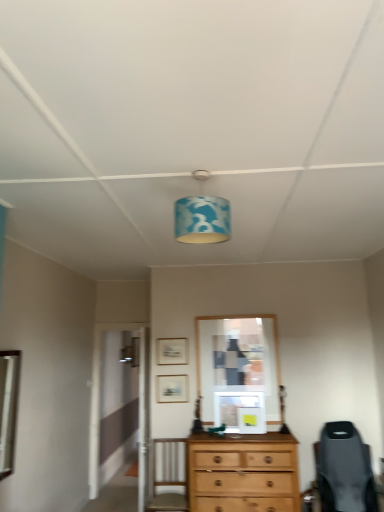
Identify the location of blue fabric lampshade at center. The width and height of the screenshot is (384, 512). (202, 219).

This screenshot has width=384, height=512. Identify the location of matte wooden picture frame at center, which appears as the 2th picture frame when viewed from the back. (172, 389).

From the image's perspective, is blue fabric lampshade at center located beneath matte wooden picture frame at center, the first picture frame positioned from the front?

Actually, blue fabric lampshade at center appears above matte wooden picture frame at center, the first picture frame positioned from the front, in the image.

From a real-world perspective, count 2nd picture frames downward from the blue fabric lampshade at center and point to it. Please provide its 2D coordinates.

[(172, 389)]

From the picture: From a real-world perspective, does blue fabric lampshade at center sit lower than matte wooden picture frame at center, which is counted as the 2th picture frame, starting from the top?

No.

Who is more distant, blue fabric lampshade at center or matte wooden picture frame at center, which is counted as the 2th picture frame, starting from the top?

matte wooden picture frame at center, which is counted as the 2th picture frame, starting from the top.

Are blue fabric lampshade at center and matte gold picture frame at center, the first picture frame from the top, located far from each other?

Absolutely, blue fabric lampshade at center is distant from matte gold picture frame at center, the first picture frame from the top.

How different are the orientations of blue fabric lampshade at center and matte gold picture frame at center, the 2th picture frame when ordered from front to back, in degrees?

179 degrees separate the facing orientations of blue fabric lampshade at center and matte gold picture frame at center, the 2th picture frame when ordered from front to back.

Choose the correct answer: Is blue fabric lampshade at center inside matte gold picture frame at center, the first picture frame from the top, or outside it?

blue fabric lampshade at center exists outside the volume of matte gold picture frame at center, the first picture frame from the top.

In the image, is blue fabric lampshade at center positioned in front of or behind matte gold picture frame at center, the first picture frame from the top?

blue fabric lampshade at center is positioned closer to the viewer than matte gold picture frame at center, the first picture frame from the top.

Which of these two, matte gold picture frame at center, which is the first picture frame in back-to-front order, or blue fabric lampshade at center, stands taller?

Standing taller between the two is blue fabric lampshade at center.

Considering the relative positions of matte gold picture frame at center, which is the first picture frame in back-to-front order, and blue fabric lampshade at center in the image provided, is matte gold picture frame at center, which is the first picture frame in back-to-front order, behind blue fabric lampshade at center?

Yes, matte gold picture frame at center, which is the first picture frame in back-to-front order, is further from the camera.

From a real-world perspective, which object rests below the other?

matte gold picture frame at center, the 2th picture frame when ordered from front to back.

Can we say matte gold picture frame at center, the 2th picture frame when ordered from front to back, lies outside blue fabric lampshade at center?

matte gold picture frame at center, the 2th picture frame when ordered from front to back, lies outside blue fabric lampshade at center's area.

Is blue fabric lampshade at center turned away from silver metallic mirror at left?

No, blue fabric lampshade at center is not facing away from silver metallic mirror at left.

Does blue fabric lampshade at center touch silver metallic mirror at left?

No, blue fabric lampshade at center is not touching silver metallic mirror at left.

Considering the sizes of blue fabric lampshade at center and silver metallic mirror at left in the image, is blue fabric lampshade at center taller or shorter than silver metallic mirror at left?

blue fabric lampshade at center is shorter than silver metallic mirror at left.

Is matte wooden picture frame at center, which appears as the 2th picture frame when viewed from the back, wider than blue fabric lampshade at center?

No, matte wooden picture frame at center, which appears as the 2th picture frame when viewed from the back, is not wider than blue fabric lampshade at center.

From a real-world perspective, is matte wooden picture frame at center, which appears as the 2th picture frame when viewed from the back, beneath blue fabric lampshade at center?

Yes, from a real-world perspective, matte wooden picture frame at center, which appears as the 2th picture frame when viewed from the back, is below blue fabric lampshade at center.

From the image's perspective, is matte wooden picture frame at center, which is counted as the 2th picture frame, starting from the top, positioned above or below blue fabric lampshade at center?

matte wooden picture frame at center, which is counted as the 2th picture frame, starting from the top, is situated lower than blue fabric lampshade at center in the image.

Is matte gold picture frame at center, the 2th picture frame when ordered from front to back, in contact with silver metallic mirror at left?

No, matte gold picture frame at center, the 2th picture frame when ordered from front to back, is not beside silver metallic mirror at left.

Does matte gold picture frame at center, the 2th picture frame when ordered from front to back, lie behind silver metallic mirror at left?

Yes.

Is matte gold picture frame at center, which is the first picture frame in back-to-front order, completely or partially outside of silver metallic mirror at left?

Absolutely, matte gold picture frame at center, which is the first picture frame in back-to-front order, is external to silver metallic mirror at left.

Measure the distance between matte wooden picture frame at center, the first picture frame positioned from the front, and silver metallic mirror at left.

The distance of matte wooden picture frame at center, the first picture frame positioned from the front, from silver metallic mirror at left is 1.57 meters.

Choose the correct answer: Is matte wooden picture frame at center, which appears as the 2th picture frame when viewed from the back, inside silver metallic mirror at left or outside it?

matte wooden picture frame at center, which appears as the 2th picture frame when viewed from the back, cannot be found inside silver metallic mirror at left.

Is matte wooden picture frame at center, which appears as the 2th picture frame when viewed from the back, in front of or behind silver metallic mirror at left in the image?

matte wooden picture frame at center, which appears as the 2th picture frame when viewed from the back, is behind silver metallic mirror at left.

Can you confirm if matte wooden picture frame at center, which is counted as the 2th picture frame, starting from the top, is thinner than silver metallic mirror at left?

Indeed, matte wooden picture frame at center, which is counted as the 2th picture frame, starting from the top, has a lesser width compared to silver metallic mirror at left.

Find the location of a particular element. The image size is (384, 512). light fixture that is above the matte wooden picture frame at center, which is the first picture frame in bottom-to-top order (from the image's perspective) is located at coordinates (202, 219).

Where is `the 2nd picture frame behind when counting from the blue fabric lampshade at center`? the 2nd picture frame behind when counting from the blue fabric lampshade at center is located at coordinates pos(172,351).

Consider the image. Looking at the image, which one is located closer to matte wooden picture frame at center, which is the first picture frame in bottom-to-top order, silver metallic mirror at left or matte gold picture frame at center, which is the first picture frame in back-to-front order?

Based on the image, matte gold picture frame at center, which is the first picture frame in back-to-front order, appears to be nearer to matte wooden picture frame at center, which is the first picture frame in bottom-to-top order.

Looking at the image, which one is located closer to silver metallic mirror at left, matte wooden picture frame at center, the first picture frame positioned from the front, or matte gold picture frame at center, which is the first picture frame in back-to-front order?

The object closer to silver metallic mirror at left is matte wooden picture frame at center, the first picture frame positioned from the front.

Based on their spatial positions, is matte gold picture frame at center, the 2th picture frame when ordered from front to back, or blue fabric lampshade at center further from matte wooden picture frame at center, which is the first picture frame in bottom-to-top order?

blue fabric lampshade at center is further to matte wooden picture frame at center, which is the first picture frame in bottom-to-top order.

Looking at the image, which one is located closer to blue fabric lampshade at center, matte wooden picture frame at center, which is counted as the 2th picture frame, starting from the top, or silver metallic mirror at left?

silver metallic mirror at left is closer to blue fabric lampshade at center.

Estimate the real-world distances between objects in this image. Which object is further from silver metallic mirror at left, matte wooden picture frame at center, which is the first picture frame in bottom-to-top order, or blue fabric lampshade at center?

blue fabric lampshade at center is positioned further to the anchor silver metallic mirror at left.

Which object lies nearer to the anchor point silver metallic mirror at left, blue fabric lampshade at center or matte wooden picture frame at center, the first picture frame positioned from the front?

matte wooden picture frame at center, the first picture frame positioned from the front, is positioned closer to the anchor silver metallic mirror at left.

When comparing their distances from silver metallic mirror at left, does matte gold picture frame at center, which is the first picture frame in back-to-front order, or blue fabric lampshade at center seem closer?

The object closer to silver metallic mirror at left is matte gold picture frame at center, which is the first picture frame in back-to-front order.

Looking at this image, estimate the real-world distances between objects in this image. Which object is further from matte wooden picture frame at center, which is counted as the 2th picture frame, starting from the top, matte gold picture frame at center, which is the first picture frame in back-to-front order, or silver metallic mirror at left?

silver metallic mirror at left.

At what (x,y) coordinates should I click in order to perform the action: click on mirror located between blue fabric lampshade at center and matte wooden picture frame at center, which is the first picture frame in bottom-to-top order, in the depth direction. Please return your answer as a coordinate pair (x, y). This screenshot has height=512, width=384. Looking at the image, I should click on (8, 408).

In order to click on picture frame located between silver metallic mirror at left and matte gold picture frame at center, the 2th picture frame when ordered from front to back, in the depth direction in this screenshot , I will do `click(172, 389)`.

Locate an element on the screen. picture frame located between blue fabric lampshade at center and matte gold picture frame at center, which is counted as the 2th picture frame, starting from the bottom, in the depth direction is located at coordinates (172, 389).

This screenshot has width=384, height=512. I want to click on mirror between blue fabric lampshade at center and matte gold picture frame at center, the 2th picture frame when ordered from front to back, along the z-axis, so (8, 408).